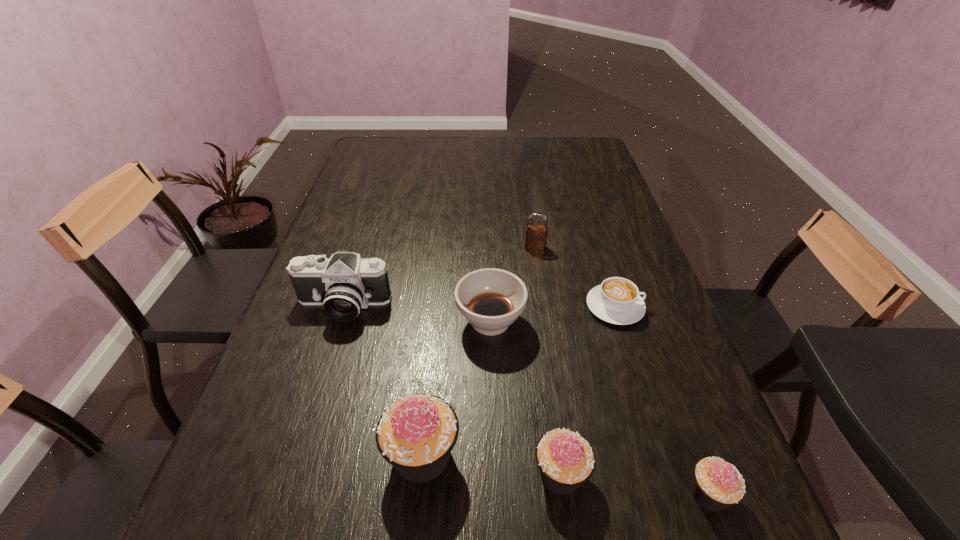
Observe the arrangement of all cupcakes in the image. To keep them evenly spaced, where would you place another cupcake on the left? Please locate a free space. Please provide its 2D coordinates. Your answer should be formatted as a tuple, i.e. [(x, y)], where the tuple contains the x and y coordinates of a point satisfying the conditions above.

[(292, 438)]